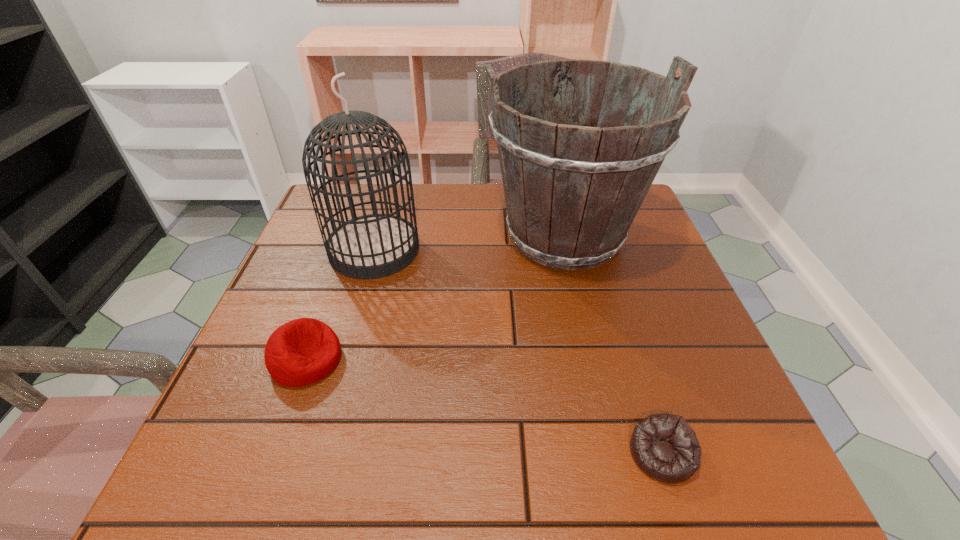
Locate an element on the screen. birdcage is located at coordinates (372, 246).

The image size is (960, 540). In order to click on bucket in this screenshot , I will do [x=572, y=192].

In order to click on the taller beanbag in this screenshot , I will do `click(303, 351)`.

Image resolution: width=960 pixels, height=540 pixels. Identify the location of the second nearest object. (303, 351).

Where is `the nearer beanbag`? Image resolution: width=960 pixels, height=540 pixels. the nearer beanbag is located at coordinates (664, 446).

Where is `the nearest object`? This screenshot has width=960, height=540. the nearest object is located at coordinates (664, 446).

Where is `vacant space located 0.120m on the front of the birdcage`? Image resolution: width=960 pixels, height=540 pixels. vacant space located 0.120m on the front of the birdcage is located at coordinates (354, 319).

You are a GUI agent. You are given a task and a screenshot of the screen. Output one action in this format:
    pyautogui.click(x=<x>, y=<y>)
    Task: Click on the blank space located 0.310m on the left of the bucket
    The image size is (960, 540).
    Given the screenshot: What is the action you would take?
    pyautogui.click(x=363, y=235)

Find the location of a particular element. The height and width of the screenshot is (540, 960). free space located 0.110m on the seat area of the third farthest object is located at coordinates (399, 359).

Where is `vacant region located 0.280m on the left of the right beanbag`? This screenshot has height=540, width=960. vacant region located 0.280m on the left of the right beanbag is located at coordinates (453, 454).